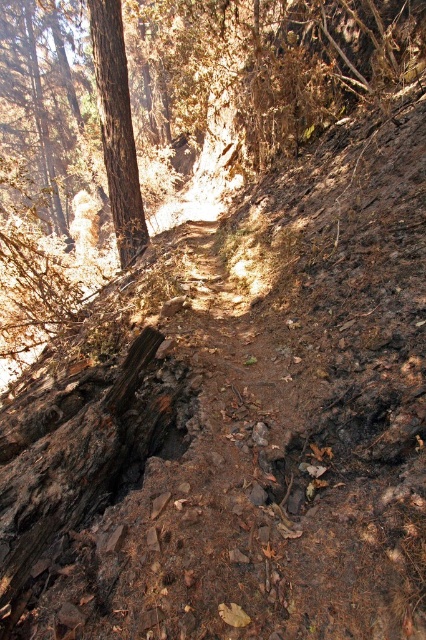
You are a hiker carrying a heavy backpack and need to cross the rugged trail. There is a charcoal textured log at lower left and a brown rough tree at left nearby. Which object is closer to you as you start your descent down the slope?

The charcoal textured log at lower left is closer to you than the brown rough tree at left as you start your descent down the slope because the distance between them is 13.64 feet, meaning the log is nearer to your starting position.

You are a hiker trying to navigate the forest trail. You see the charcoal textured log at lower left and the brown rough tree at left. Which object is closer to the ground?

The charcoal textured log at lower left is closer to the ground because it is positioned below the brown rough tree at left.